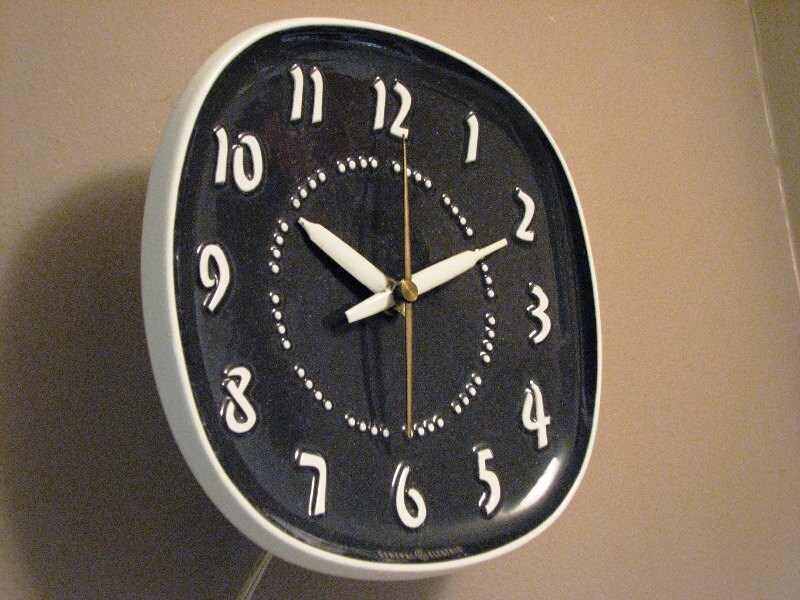
You are a GUI agent. You are given a task and a screenshot of the screen. Output one action in this format:
    pyautogui.click(x=<x>, y=<y>)
    Task: Click on the brown wall
    This screenshot has height=600, width=800.
    Given the screenshot: What is the action you would take?
    pyautogui.click(x=124, y=78)